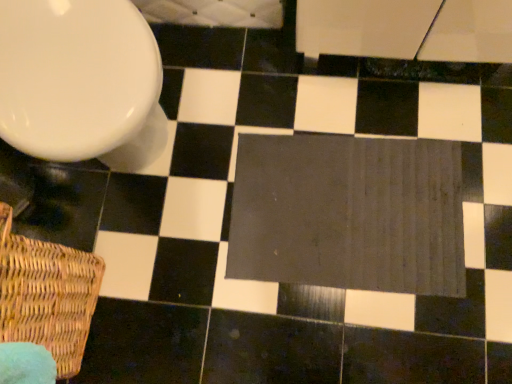
Locate an element on the screen. free area in between white glossy toilet at upper left and dark gray fabric bath mat at center is located at coordinates (247, 128).